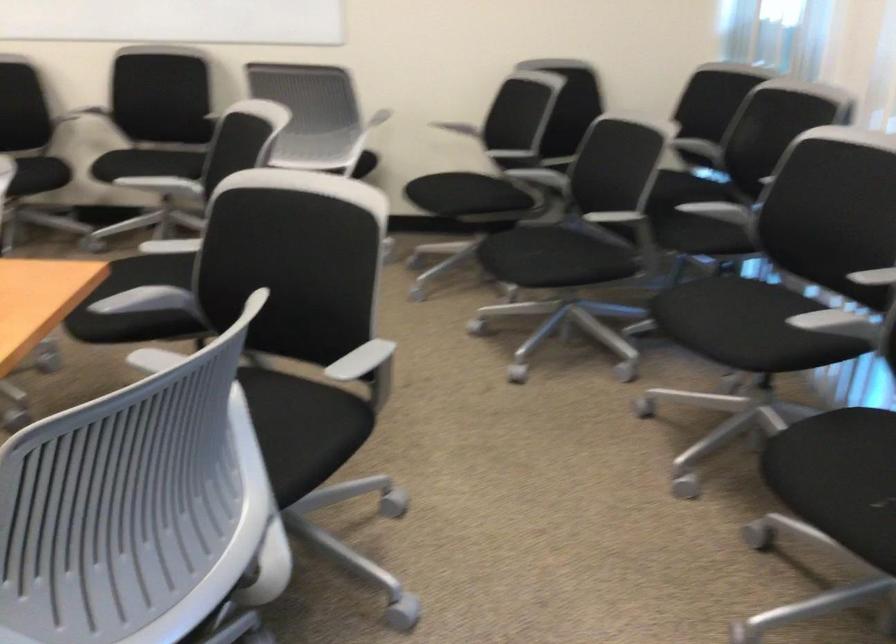
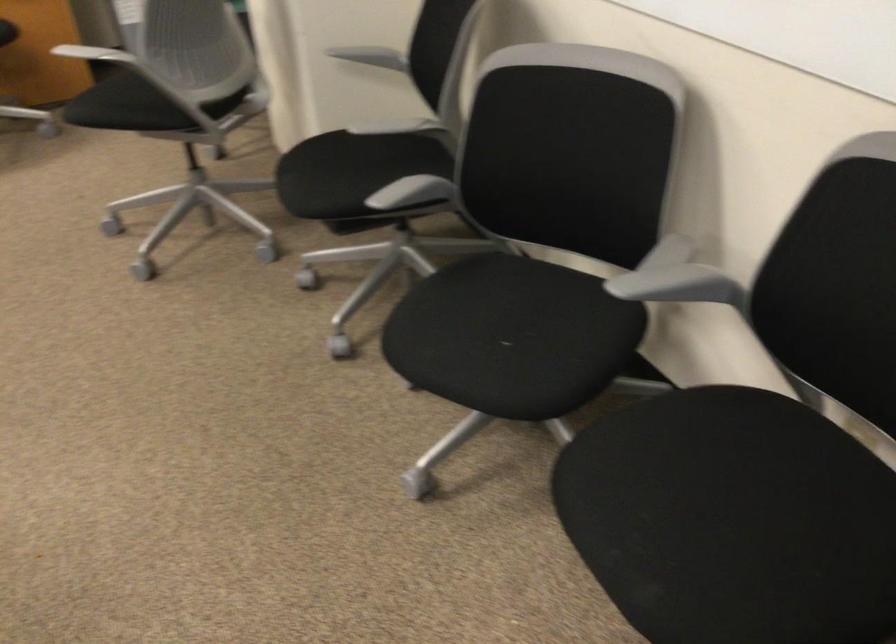
The point at (148,152) is marked in the first image. Where is the corresponding point in the second image?

(711, 458)